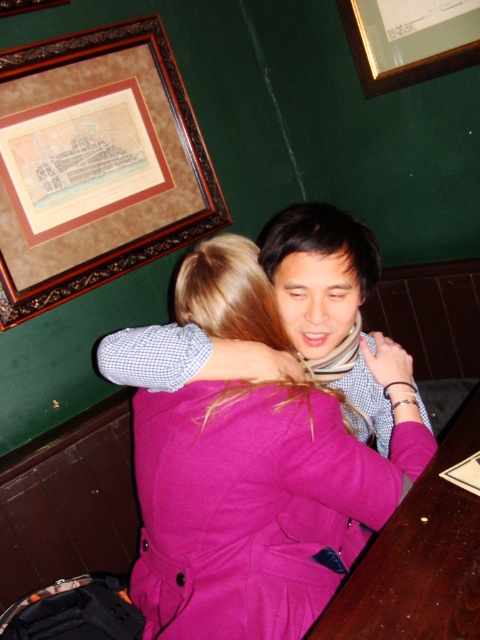
Is purple wool coat at center to the right of gold-framed picture at upper center from the viewer's perspective?

No, purple wool coat at center is not to the right of gold-framed picture at upper center.

Looking at this image, who is positioned more to the left, purple wool coat at center or gold-framed picture at upper center?

From the viewer's perspective, purple wool coat at center appears more on the left side.

Image resolution: width=480 pixels, height=640 pixels. Find the location of `purple wool coat at center`. purple wool coat at center is located at coordinates (261, 499).

Does wooden table at lower right appear on the left side of gold-framed picture at upper center?

Correct, you'll find wooden table at lower right to the left of gold-framed picture at upper center.

Can you confirm if wooden table at lower right is taller than gold-framed picture at upper center?

Yes, wooden table at lower right is taller than gold-framed picture at upper center.

Is point (456, 632) farther from camera compared to point (468, 52)?

No, (456, 632) is closer to viewer.

You are a GUI agent. You are given a task and a screenshot of the screen. Output one action in this format:
    pyautogui.click(x=<x>, y=<y>)
    Task: Click on the wooden table at lower right
    This screenshot has height=640, width=480.
    Given the screenshot: What is the action you would take?
    pyautogui.click(x=420, y=545)

Is purple wool coat at center to the left of wooden framed map at upper left from the viewer's perspective?

No, purple wool coat at center is not to the left of wooden framed map at upper left.

Is point (208, 301) less distant than point (154, 109)?

Yes, it is in front of point (154, 109).

This screenshot has height=640, width=480. What do you see at coordinates (261, 499) in the screenshot?
I see `purple wool coat at center` at bounding box center [261, 499].

The image size is (480, 640). Identify the location of purple wool coat at center. (261, 499).